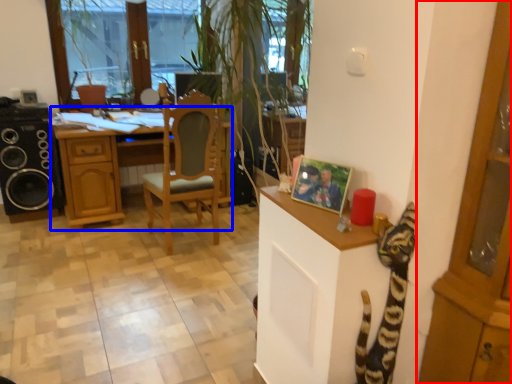
Question: Which object appears closest to the camera in this image, cabinetry (highlighted by a red box) or desk (highlighted by a blue box)?

Choices:
 (A) cabinetry
 (B) desk

Answer: (A)